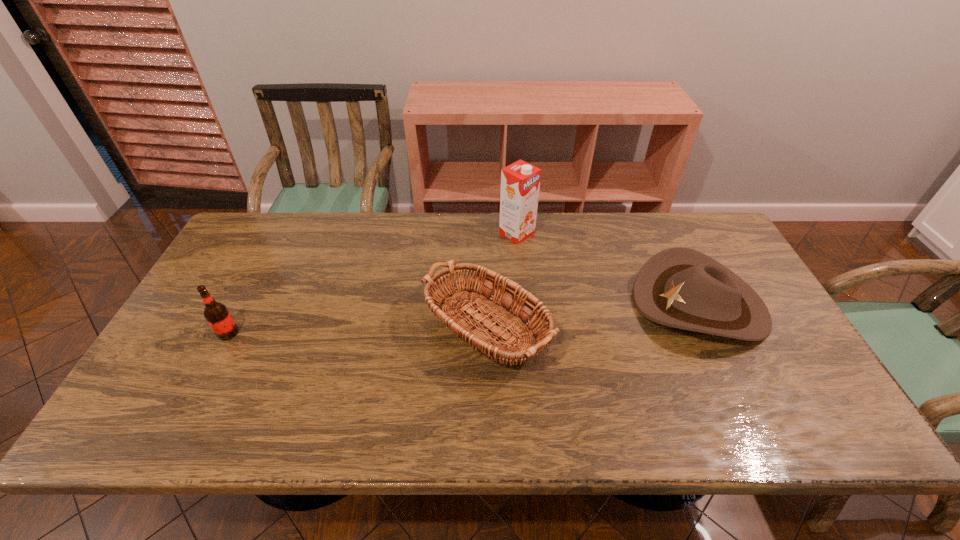
Image resolution: width=960 pixels, height=540 pixels. Identify the location of the tallest object. (520, 181).

Identify the location of carton. (520, 181).

Find the location of a particular element. The image size is (960, 540). the leftmost object is located at coordinates (217, 315).

You are a GUI agent. You are given a task and a screenshot of the screen. Output one action in this format:
    pyautogui.click(x=<x>, y=<y>)
    Task: Click on the basket
    This screenshot has height=540, width=960.
    Given the screenshot: What is the action you would take?
    pyautogui.click(x=520, y=345)

Locate an element on the screen. The width and height of the screenshot is (960, 540). the rightmost object is located at coordinates (678, 287).

This screenshot has height=540, width=960. I want to click on the shortest object, so click(x=678, y=287).

This screenshot has height=540, width=960. Find the location of `vacant space located on the front of the carton`. vacant space located on the front of the carton is located at coordinates coord(527,338).

At what (x,y) coordinates should I click in order to perform the action: click on free space located on the back of the root beer. Please return your answer as a coordinate pair (x, y). The image size is (960, 540). Looking at the image, I should click on (274, 246).

The width and height of the screenshot is (960, 540). What are the coordinates of `free space located 0.110m on the left of the basket` in the screenshot? It's located at (352, 345).

Where is `vacant region located 0.400m with a star on the front of the cowboy hat`? The width and height of the screenshot is (960, 540). vacant region located 0.400m with a star on the front of the cowboy hat is located at coordinates (492, 304).